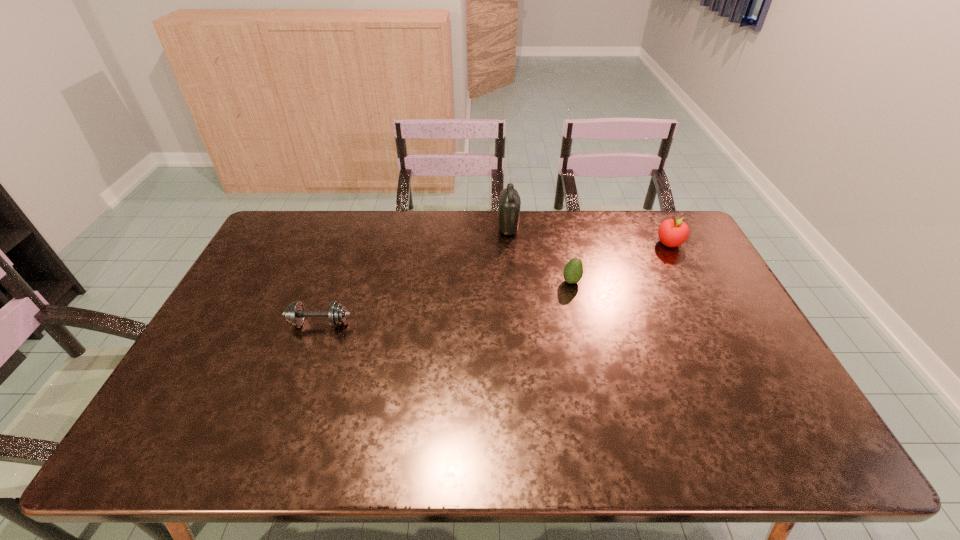
At what (x,y) coordinates should I click in order to perform the action: click on the second object from left to right. Please return your answer as a coordinate pair (x, y). Looking at the image, I should click on (509, 200).

What are the coordinates of `the tallest object` in the screenshot? It's located at (509, 200).

You are a GUI agent. You are given a task and a screenshot of the screen. Output one action in this format:
    pyautogui.click(x=<x>, y=<y>)
    Task: Click on the rightmost object
    
    Given the screenshot: What is the action you would take?
    pyautogui.click(x=673, y=232)

Find the location of a particular element. The width and height of the screenshot is (960, 540). apple is located at coordinates pos(673,232).

I want to click on the third farthest object, so point(573,271).

This screenshot has width=960, height=540. Find the location of `avocado`. avocado is located at coordinates (573, 271).

Where is `the shortest object`? This screenshot has height=540, width=960. the shortest object is located at coordinates (295, 313).

Image resolution: width=960 pixels, height=540 pixels. I want to click on dumbbell, so click(x=295, y=313).

This screenshot has width=960, height=540. I want to click on vacant space located 0.130m on the right of the second object from left to right, so click(554, 228).

The height and width of the screenshot is (540, 960). I want to click on vacant space situated on the front of the rightmost object, so click(x=701, y=302).